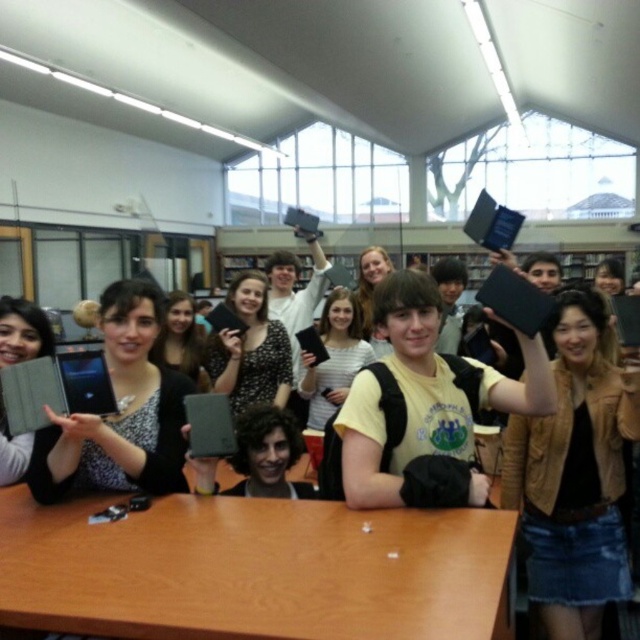
Which is more to the right, brown leather jacket at upper right or black dotted shirt at center?

brown leather jacket at upper right

Which of these two, brown leather jacket at upper right or black dotted shirt at center, stands shorter?

With less height is black dotted shirt at center.

Which is in front, point (628, 381) or point (241, 342)?

Point (628, 381) is more forward.

Locate an element on the screen. This screenshot has width=640, height=640. brown leather jacket at upper right is located at coordinates 576,474.

Consider the image. Between brown leather jacket at upper right and matte black tablet at left, which one is positioned higher?

Positioned higher is matte black tablet at left.

The height and width of the screenshot is (640, 640). Find the location of `brown leather jacket at upper right`. brown leather jacket at upper right is located at coordinates (576, 474).

Does point (266, 579) lie in front of point (365, 476)?

Yes, it is in front of point (365, 476).

Between point (264, 532) and point (360, 432), which one is positioned in front?

Point (264, 532) is more forward.

At what (x,y) coordinates should I click in order to perform the action: click on wooden table at center. Please return your answer as a coordinate pair (x, y). This screenshot has width=640, height=640. Looking at the image, I should click on (253, 570).